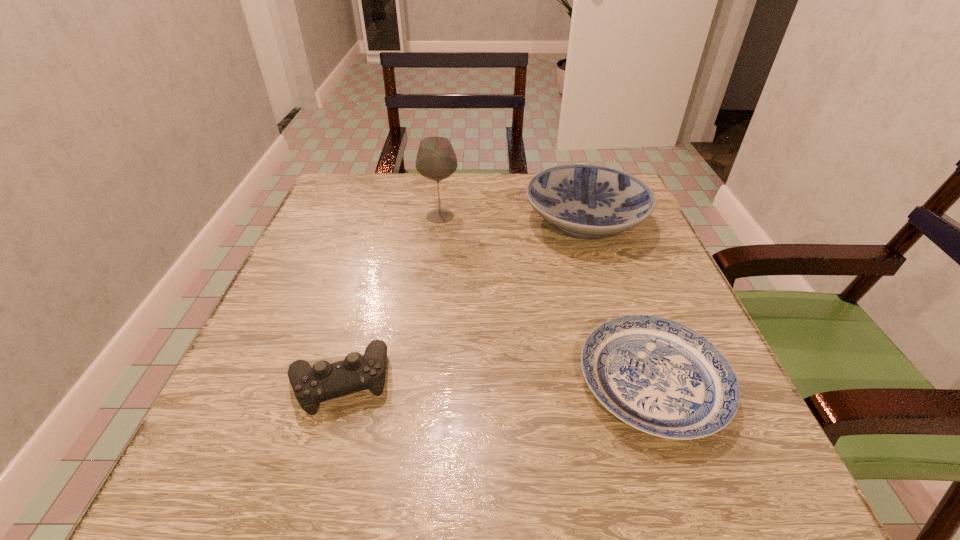
Find the location of a particular element. vacant space at the left edge of the desktop is located at coordinates (272, 305).

Locate an element on the screen. This screenshot has height=540, width=960. free space at the right edge is located at coordinates (592, 269).

Where is `vacant space at the far left corner of the desktop`? The height and width of the screenshot is (540, 960). vacant space at the far left corner of the desktop is located at coordinates (355, 193).

Image resolution: width=960 pixels, height=540 pixels. I want to click on vacant area at the near right corner, so click(x=769, y=502).

Where is `vacant space that is in between the third shortest object and the third tallest object`? The height and width of the screenshot is (540, 960). vacant space that is in between the third shortest object and the third tallest object is located at coordinates coord(462,300).

The width and height of the screenshot is (960, 540). I want to click on blank region between the control and the tallest object, so click(390, 298).

The height and width of the screenshot is (540, 960). I want to click on empty location between the leftmost object and the farther plate, so click(x=462, y=300).

Locate an element on the screen. The width and height of the screenshot is (960, 540). unoccupied area between the leftmost object and the third object from right to left is located at coordinates (390, 298).

Find the location of a particular element. empty space that is in between the tallest object and the taller plate is located at coordinates [513, 218].

Where is `vacant space that is in between the tallest object and the shorter plate`? vacant space that is in between the tallest object and the shorter plate is located at coordinates (546, 299).